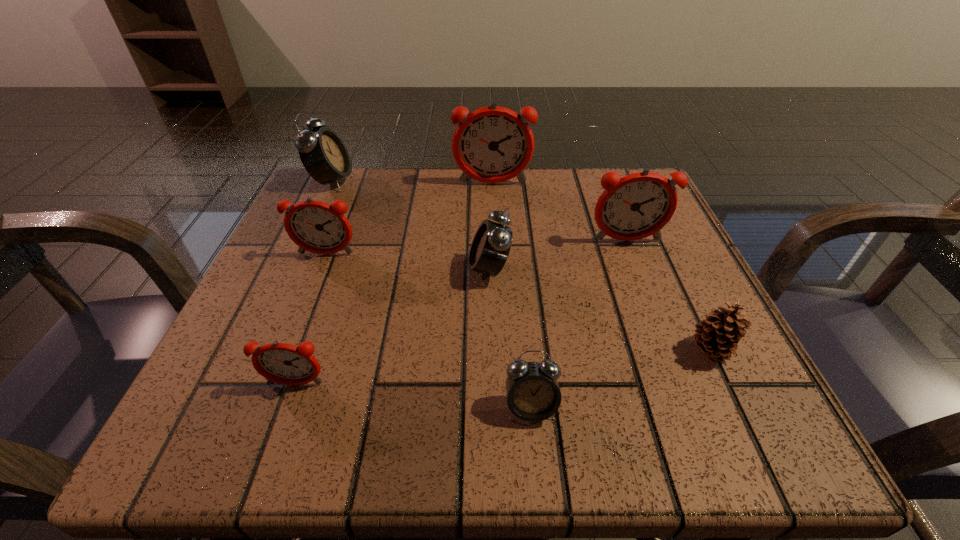
Identify the location of the nearest white alarm clock. (533, 394).

Identify the location of free spot located 0.090m on the front-facing side of the third reddish-pink alarm clock from left to right. (493, 212).

Find the location of `vacant space located on the face of the leftmost white alarm clock`. vacant space located on the face of the leftmost white alarm clock is located at coordinates (424, 181).

Find the location of `blank space located 0.080m on the front-facing side of the third smallest reddish-pink alarm clock`. blank space located 0.080m on the front-facing side of the third smallest reddish-pink alarm clock is located at coordinates (640, 276).

You are a GUI agent. You are given a task and a screenshot of the screen. Output one action in this format:
    pyautogui.click(x=<x>, y=<y>)
    Task: Click on the blank space located 0.100m on the face of the second nearest white alarm clock
    
    Given the screenshot: What is the action you would take?
    pyautogui.click(x=410, y=270)

Image resolution: width=960 pixels, height=540 pixels. Find the location of `free spot located on the face of the second nearest white alarm clock`. free spot located on the face of the second nearest white alarm clock is located at coordinates (301, 270).

I want to click on free region located 0.090m on the face of the second nearest white alarm clock, so click(416, 270).

Identify the location of vacant region located 0.140m on the front-facing side of the third biggest reddish-pink alarm clock. (301, 318).

At what (x,y) coordinates should I click in order to perform the action: click on vacant area situated on the back of the sixth farthest object. Please return your answer as a coordinate pair (x, y). The image size is (960, 540). Looking at the image, I should click on (657, 236).

Where is `vacant space located 0.070m on the front-facing side of the nearest reddish-pink alarm clock`? vacant space located 0.070m on the front-facing side of the nearest reddish-pink alarm clock is located at coordinates (276, 441).